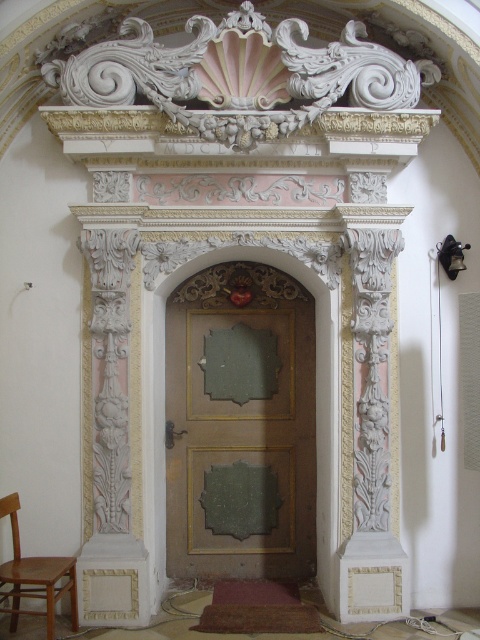
You are an architect examining the doorway and want to install a new light fixture. You have two points marked on the design plan at coordinates point (232, 547) and point (50, 618). If you want to place the light fixture in front of the decorative crest, which point should you choose?

Point (50, 618) should be chosen because it is in front of point (232, 547), which is behind it according to the description. Since the decorative crest is at the top, placing the light fixture at the point closer to the viewer would be in front of it.

You are standing in front of the doorway and need to enter the building. There is a green wood door at center and a wooden chair at lower left. Which object should you approach to enter the building?

To enter the building, you should approach the green wood door at center since it is a door, while the wooden chair at lower left is just an obstacle placed to the left of the door.

You are a painter who needs to hang a 2.5 meter tall canvas on the wall behind the green wood door at center and the wooden chair at lower left. Considering their heights, which object would allow the canvas to be placed above it without obstruction?

The green wood door at center has a greater height compared to the wooden chair at lower left, so placing the canvas above the green wood door at center would ensure it is tall enough to avoid obstruction.